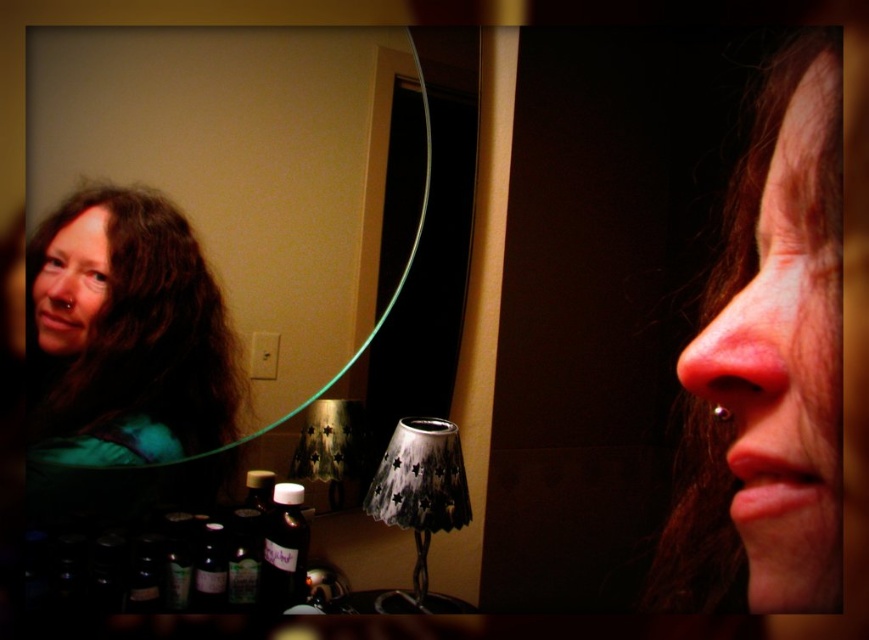
You are organizing a bathroom shelf and need to place the translucent glass bottle at lower left and the translucent dark bottle at lower center. According to the image, which bottle is positioned higher on the shelf?

The translucent glass bottle at lower left is located above the translucent dark bottle at lower center, so it is positioned higher on the shelf.

You are standing in front of a bathroom mirror and notice two points marked on the wall. The first point is at coordinate point(104, 51) and the second point is at coordinate point(289, 572). Which point is closer to you?

Point(104, 51) is in front of point(289, 572), so it is closer to you.

Based on the photo, you are organizing a bathroom shelf and need to place the translucent glass bottle at lower left and the translucent dark bottle at lower center. According to their positions on the counter, which bottle is located to the left of the other?

The translucent glass bottle at lower left is positioned on the left side of the translucent dark bottle at lower center, so it is located to the left of the latter.